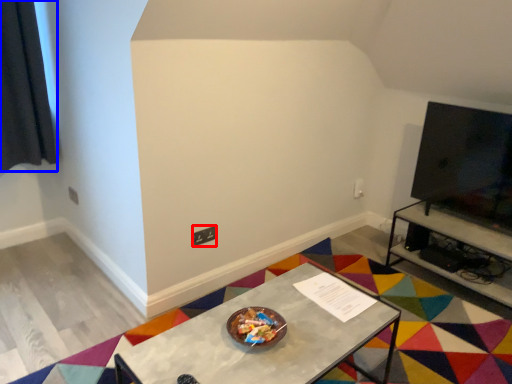
Question: Among these objects, which one is farthest to the camera, square (highlighted by a red box) or curtain (highlighted by a blue box)?

Choices:
 (A) square
 (B) curtain

Answer: (A)